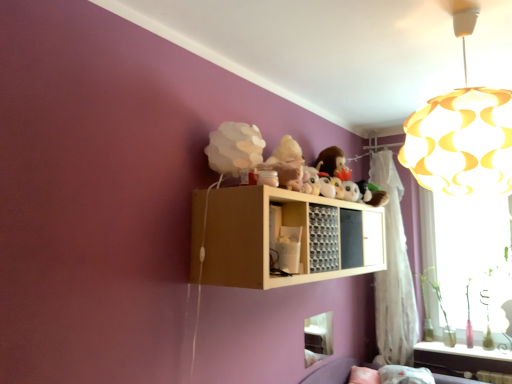
Question: From a real-world perspective, is fuzzy fabric plush at upper center above or below yellow paper lampshade at upper right?

Choices:
 (A) below
 (B) above

Answer: (A)

Question: Is fuzzy fabric plush at upper center to the left or to the right of yellow paper lampshade at upper right in the image?

Choices:
 (A) right
 (B) left

Answer: (B)

Question: Estimate the real-world distances between objects in this image. Which object is farther from the yellow paper lampshade at upper right?

Choices:
 (A) fuzzy fabric plush at upper center
 (B) transparent glass window at right, which is counted as the 2th window screen, starting from the front
 (C) white matte cloud at upper center
 (D) white sheer curtain at right
 (E) wooden grid at upper center

Answer: (D)

Question: Considering the real-world distances, which object is farthest from the white matte cloud at upper center?

Choices:
 (A) transparent glass window at right, placed as the 1th window screen when sorted from right to left
 (B) yellow paper lampshade at upper right
 (C) transparent plastic window screen at lower center, which appears as the 2th window screen when viewed from the right
 (D) white sheer curtain at right
 (E) translucent glass bottles at lower right

Answer: (E)